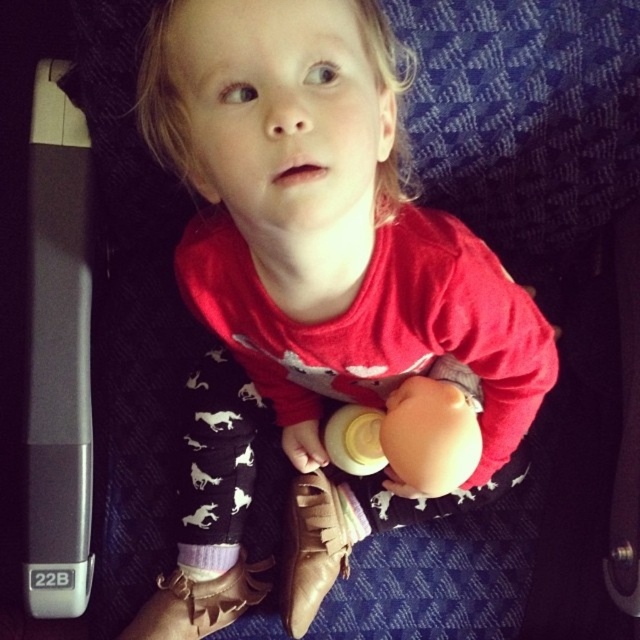
Find the location of a particular element. matte red shirt at center is located at coordinates (321, 272).

Is leather shoe at center thinner than purple knitted sock at lower center?

In fact, leather shoe at center might be wider than purple knitted sock at lower center.

Measure the distance between leather shoe at center and purple knitted sock at lower center.

leather shoe at center and purple knitted sock at lower center are 4.57 inches apart from each other.

Is point (332, 509) in front of point (186, 566)?

No, it is not.

The image size is (640, 640). In order to click on leather shoe at center in this screenshot , I will do pyautogui.click(x=310, y=548).

Can you confirm if leather shoe at center is positioned above white plastic bottle at center?

Incorrect, leather shoe at center is not positioned above white plastic bottle at center.

Can you confirm if leather shoe at center is bigger than white plastic bottle at center?

Yes.

Is point (307, 500) less distant than point (355, 474)?

No.

The image size is (640, 640). Find the location of `leather shoe at center`. leather shoe at center is located at coordinates (310, 548).